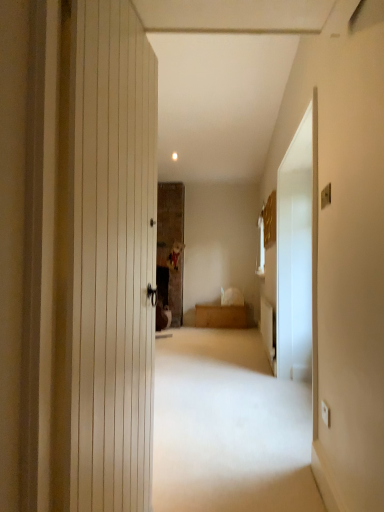
Question: Considering the positions of wooden chest at center and transparent glass screen door at right in the image, is wooden chest at center taller or shorter than transparent glass screen door at right?

Choices:
 (A) short
 (B) tall

Answer: (A)

Question: From a real-world perspective, relative to transparent glass screen door at right, is wooden chest at center vertically above or below?

Choices:
 (A) below
 (B) above

Answer: (A)

Question: From the image's perspective, is wooden chest at center above or below transparent glass screen door at right?

Choices:
 (A) below
 (B) above

Answer: (A)

Question: Considering the relative positions of transparent glass screen door at right and wooden chest at center in the image provided, is transparent glass screen door at right to the left or to the right of wooden chest at center?

Choices:
 (A) right
 (B) left

Answer: (A)

Question: Considering the positions of point (301, 312) and point (208, 305), is point (301, 312) closer or farther from the camera than point (208, 305)?

Choices:
 (A) farther
 (B) closer

Answer: (B)

Question: Choose the correct answer: Is transparent glass screen door at right inside wooden chest at center or outside it?

Choices:
 (A) inside
 (B) outside

Answer: (B)

Question: From the image's perspective, is transparent glass screen door at right located above or below wooden chest at center?

Choices:
 (A) above
 (B) below

Answer: (A)